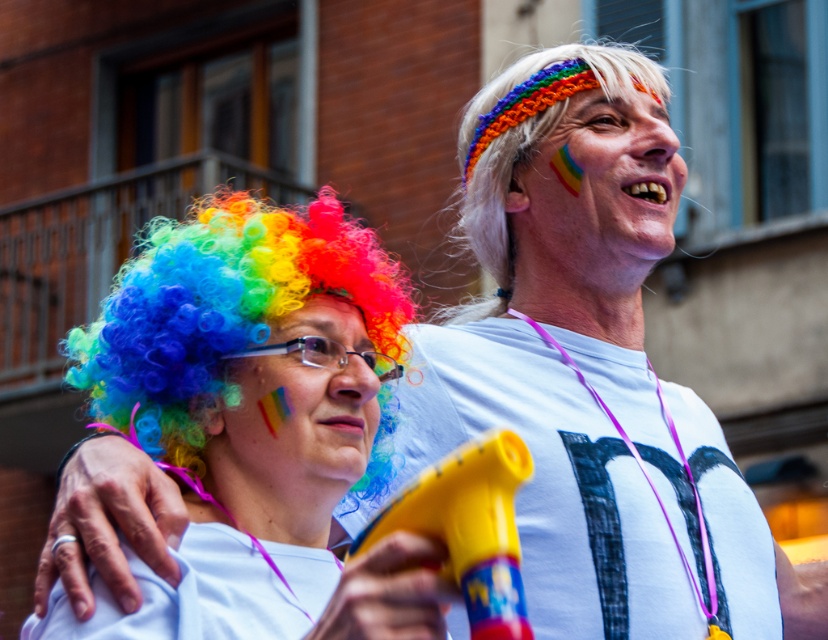
You are organizing a costume party and need to ensure all participants have wigs that fit properly. You have two rainbow wigs available. One is labeled as the rainbow wig at left and the other as the rainbow wig at center. If a guest prefers a wig that covers more of their head, which one should you recommend?

The rainbow wig at left is larger in size than the rainbow wig at center, so it would cover more of the guest head.

You are a photographer at the event and want to frame both the rainbow fabric headband at upper center and the white knitted headband at upper right in your shot. Which headband will appear smaller in the photo?

The rainbow fabric headband at upper center will appear smaller in the photo because it is shorter than the white knitted headband at upper right.